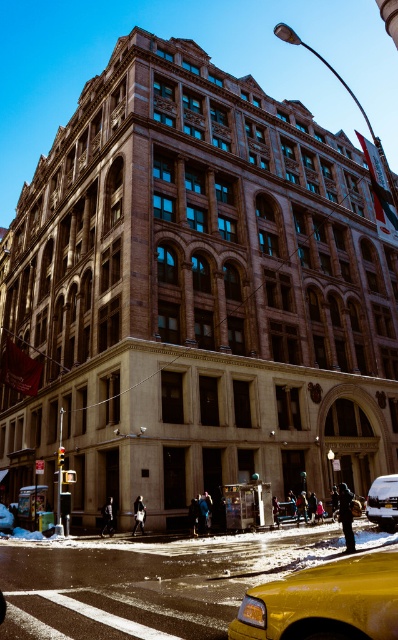
Does yellow matte taxi at lower right have a greater height compared to silver metallic van at center?

In fact, yellow matte taxi at lower right may be shorter than silver metallic van at center.

Can you confirm if yellow matte taxi at lower right is positioned to the left of silver metallic van at center?

Yes, yellow matte taxi at lower right is to the left of silver metallic van at center.

Between point (267, 624) and point (372, 509), which one is positioned in front?

Point (267, 624) is more forward.

You are a GUI agent. You are given a task and a screenshot of the screen. Output one action in this format:
    pyautogui.click(x=<x>, y=<y>)
    Task: Click on the yellow matte taxi at lower right
    
    Given the screenshot: What is the action you would take?
    pyautogui.click(x=325, y=602)

Is yellow plastic taxi at center below yellow matte taxi at lower right?

Yes, yellow plastic taxi at center is below yellow matte taxi at lower right.

Who is shorter, yellow plastic taxi at center or yellow matte taxi at lower right?

Standing shorter between the two is yellow matte taxi at lower right.

The image size is (398, 640). Describe the element at coordinates (146, 582) in the screenshot. I see `yellow plastic taxi at center` at that location.

Where is `yellow plastic taxi at center`? yellow plastic taxi at center is located at coordinates (146, 582).

Can you confirm if yellow plastic taxi at center is positioned to the right of silver metallic van at center?

In fact, yellow plastic taxi at center is to the left of silver metallic van at center.

Describe the element at coordinates (146, 582) in the screenshot. This screenshot has height=640, width=398. I see `yellow plastic taxi at center` at that location.

The width and height of the screenshot is (398, 640). What do you see at coordinates (146, 582) in the screenshot? I see `yellow plastic taxi at center` at bounding box center [146, 582].

You are a GUI agent. You are given a task and a screenshot of the screen. Output one action in this format:
    pyautogui.click(x=<x>, y=<y>)
    Task: Click on the yellow plastic taxi at center
    The width and height of the screenshot is (398, 640).
    Given the screenshot: What is the action you would take?
    pyautogui.click(x=146, y=582)